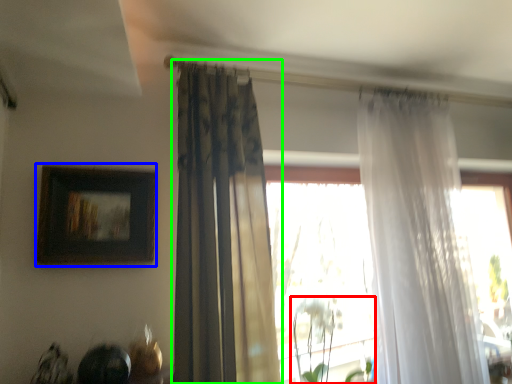
Question: Estimate the real-world distances between objects in this image. Which object is farther from plant (highlighted by a red box), picture frame (highlighted by a blue box) or curtain (highlighted by a green box)?

Choices:
 (A) picture frame
 (B) curtain

Answer: (A)